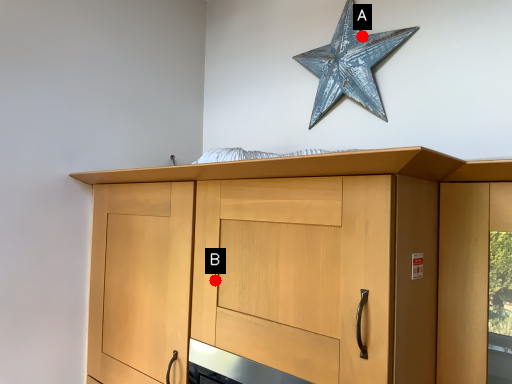
Question: Two points are circled on the image, labeled by A and B beside each circle. Which of the following is the farthest from the observer?

Choices:
 (A) A is further
 (B) B is further

Answer: (A)